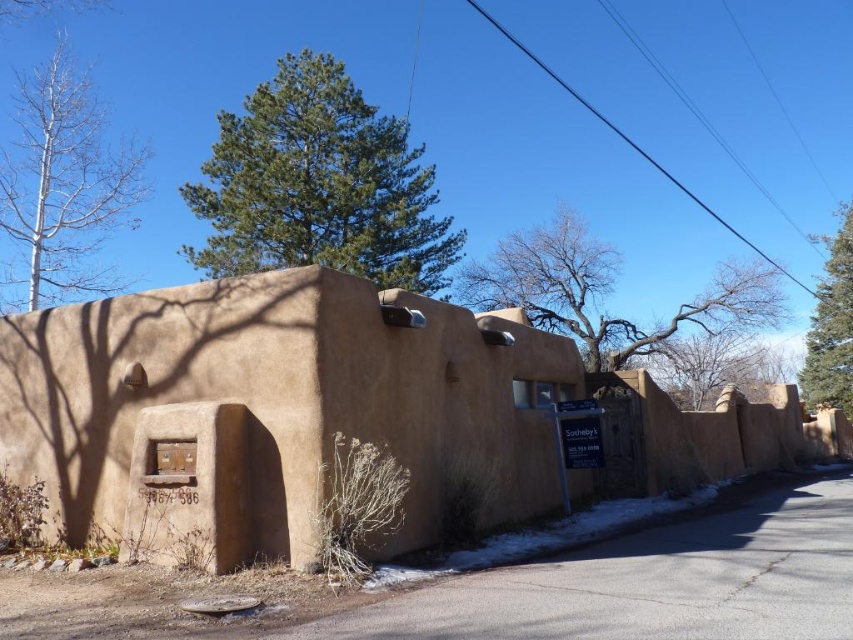
Question: Which of these objects is positioned farthest from the green coniferous tree at upper center?

Choices:
 (A) adobe wall at center
 (B) white smooth tree at left
 (C) bare branches at upper center

Answer: (A)

Question: Is the position of white smooth tree at left more distant than that of green coniferous tree at upper right?

Choices:
 (A) yes
 (B) no

Answer: (B)

Question: Is white smooth tree at left bigger than green coniferous tree at upper right?

Choices:
 (A) yes
 (B) no

Answer: (B)

Question: Which is farther from the white smooth tree at left?

Choices:
 (A) green coniferous tree at upper right
 (B) adobe wall at center
 (C) green coniferous tree at upper center
 (D) bare branches at upper center

Answer: (A)

Question: From the image, what is the correct spatial relationship of adobe wall at center in relation to green coniferous tree at upper right?

Choices:
 (A) below
 (B) above

Answer: (A)

Question: Which of the following is the closest to the observer?

Choices:
 (A) click(x=125, y=212)
 (B) click(x=846, y=257)
 (C) click(x=260, y=221)
 (D) click(x=668, y=326)

Answer: (A)